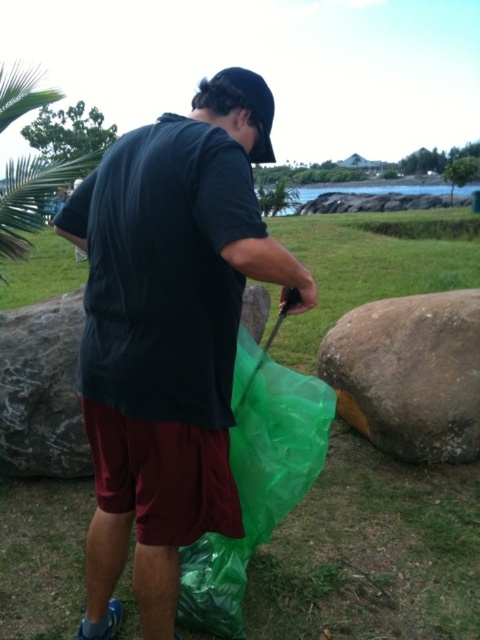
You are a hiker who needs to place a small backpack between the brown rough boulder at right and the gray textured rock at left. Since the backpack is 0.5 meters wide, will it fit between them?

The brown rough boulder at right is wider than the gray textured rock at left. However, the exact distance between them isn not specified in the objects description. Therefore, it is uncertain if the backpack will fit.

In the scene shown: You are standing at the origin point of the coordinate system. There is a matte black shirt at center located at point (x=167, y=340). If you want to walk towards the matte black shirt at center, in which direction should you move?

You should move in the direction of the point (x=167, y=340) to reach the matte black shirt at center.

You are a drone operator trying to locate a specific point in the image. The point you need to find is at coordinates point (41, 388). According to the scene description, where exactly is this point located?

The point (41, 388) is on the gray textured rock at left.